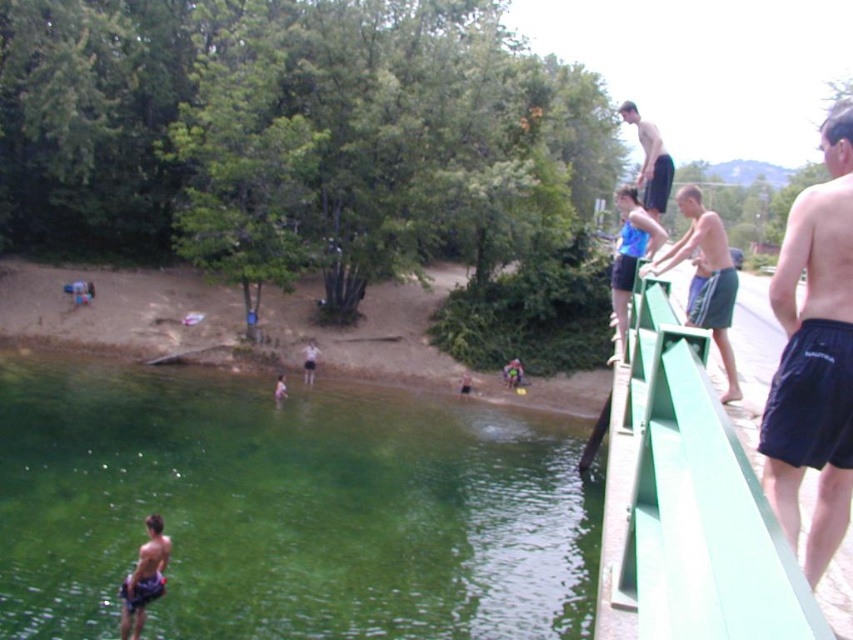
Can you confirm if smooth skin child at lower left is smaller than smooth black shorts at upper right?

Indeed, smooth skin child at lower left has a smaller size compared to smooth black shorts at upper right.

What do you see at coordinates (144, 579) in the screenshot?
I see `smooth skin child at lower left` at bounding box center [144, 579].

I want to click on smooth skin child at lower left, so click(x=144, y=579).

Describe the element at coordinates (285, 509) in the screenshot. I see `green translucent water at lower left` at that location.

Is point (308, 634) behind point (613, 285)?

Yes, point (308, 634) is farther from viewer.

Locate an element on the screen. green translucent water at lower left is located at coordinates (285, 509).

Between point (630, 189) and point (158, 538), which one is positioned in front?

Positioned in front is point (630, 189).

Is blue fabric shorts at upper right thinner than smooth skin child at lower left?

Incorrect, blue fabric shorts at upper right's width is not less than smooth skin child at lower left's.

You are a GUI agent. You are given a task and a screenshot of the screen. Output one action in this format:
    pyautogui.click(x=<x>, y=<y>)
    Task: Click on the blue fabric shorts at upper right
    The image size is (853, 640).
    Given the screenshot: What is the action you would take?
    pyautogui.click(x=630, y=259)